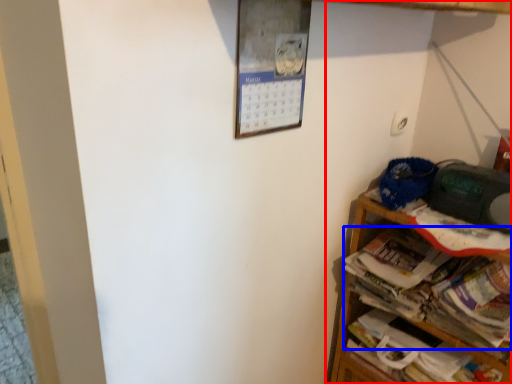
Question: Which object appears closest to the camera in this image, shelf (highlighted by a red box) or magazine (highlighted by a blue box)?

Choices:
 (A) shelf
 (B) magazine

Answer: (A)